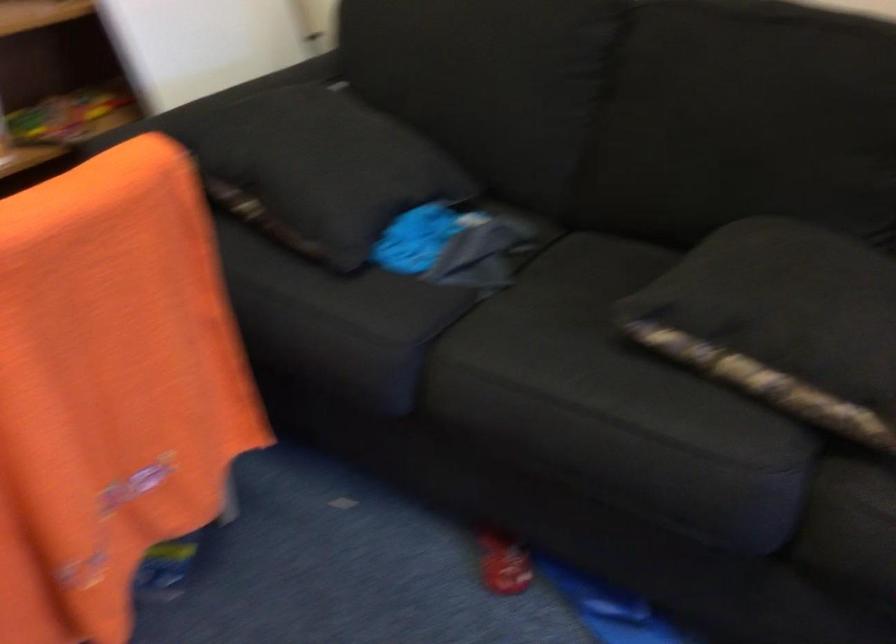
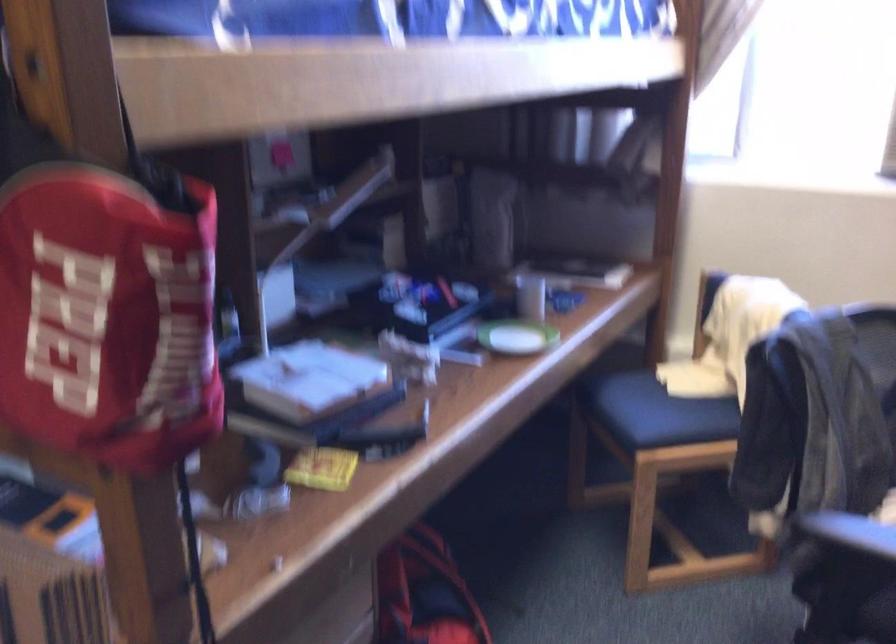
The images are taken continuously from a first-person perspective. In which direction is your viewpoint rotating?

The rotation direction of the camera is right-down.